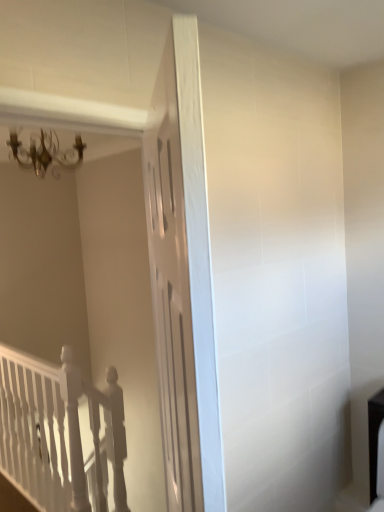
Identify the location of white matte railing at lower left. (60, 433).

What do you see at coordinates (60, 433) in the screenshot? This screenshot has height=512, width=384. I see `white matte railing at lower left` at bounding box center [60, 433].

Where is `white matte railing at lower left`? The width and height of the screenshot is (384, 512). white matte railing at lower left is located at coordinates (60, 433).